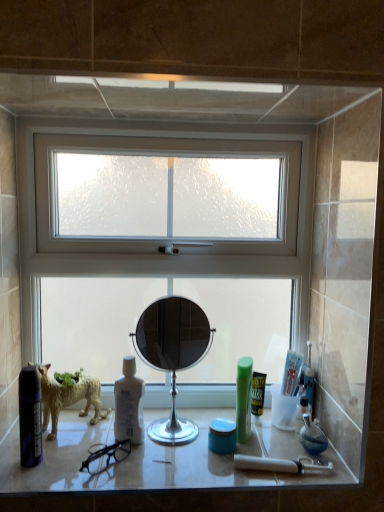
Question: From the image's perspective, is matte black can at left positioned above or below green plastic bottle at center-right?

Choices:
 (A) above
 (B) below

Answer: (A)

Question: Is matte black can at left inside or outside of green plastic bottle at center-right?

Choices:
 (A) outside
 (B) inside

Answer: (A)

Question: Based on their relative distances, which object is farther from the matte black can at left?

Choices:
 (A) green plastic mouthwash at right, the 1th mouthwash in the right-to-left sequence
 (B) white glossy countertop at center
 (C) white frosted glass window at center
 (D) green plastic bottle at center-right
 (E) white glossy mouthwash at center, which ranks as the third mouthwash in right-to-left order

Answer: (A)

Question: Based on their relative distances, which object is nearer to the green plastic bottle at center-right?

Choices:
 (A) silver/metallic mirror at center
 (B) white glossy mouthwash at center, the 1th mouthwash viewed from the left
 (C) speckled ceramic figurine at lower left
 (D) white glossy countertop at center
 (E) blue matte jar at center, the second mouthwash positioned from the left

Answer: (E)